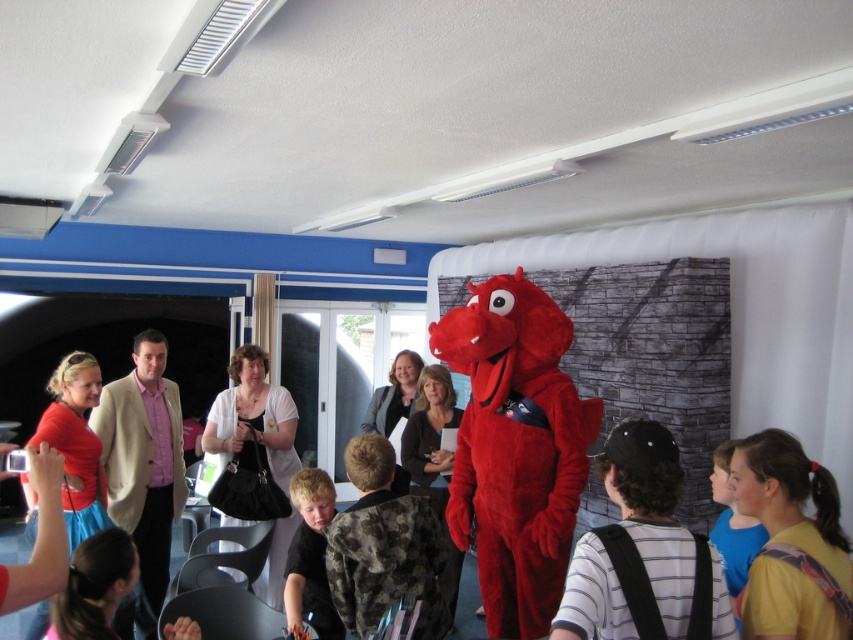
Question: Among these objects, which one is nearest to the camera?

Choices:
 (A) striped cotton shirt at center
 (B) blonde hair boy at center
 (C) fuzzy red dragon at center
 (D) black fabric dress at center

Answer: (A)

Question: Can you confirm if fuzzy red dragon at center is positioned to the right of striped cotton shirt at center?

Choices:
 (A) yes
 (B) no

Answer: (B)

Question: Which point appears closest to the camera in this image?

Choices:
 (A) (579, 596)
 (B) (560, 323)

Answer: (A)

Question: Does blonde hair boy at center appear over black fabric dress at center?

Choices:
 (A) yes
 (B) no

Answer: (A)

Question: Can you confirm if yellow printed shirt at lower right is positioned above blonde hair boy at center?

Choices:
 (A) no
 (B) yes

Answer: (B)

Question: Which object is the closest to the striped cotton shirt at center?

Choices:
 (A) fuzzy red dragon at center
 (B) blonde hair boy at center

Answer: (A)